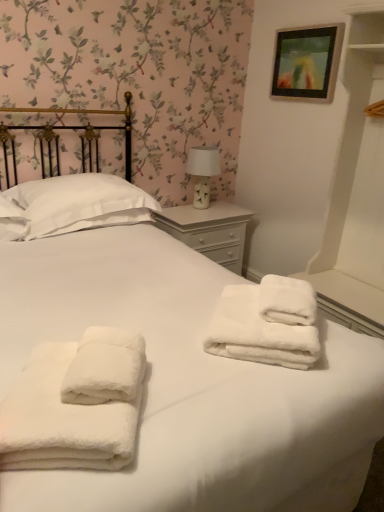
This screenshot has width=384, height=512. Find the location of `white fluffy towels at center, the 1th towel when ordered from front to back`. white fluffy towels at center, the 1th towel when ordered from front to back is located at coordinates (63, 420).

Measure the distance between point (223, 206) and camera.

Point (223, 206) is 3.17 meters away from camera.

Measure the distance between white fluffy towels at center, arranged as the 2th towel when viewed from the left, and camera.

1.26 meters.

Locate an element on the screen. This screenshot has height=512, width=384. white fluffy towels at center, the 1th towel when ordered from front to back is located at coordinates (63, 420).

Would you say white soft pillow at upper left is inside or outside white painted wood nightstand at center?

The correct answer is: outside.

Where is `pillow to the left of white painted wood nightstand at center`? The image size is (384, 512). pillow to the left of white painted wood nightstand at center is located at coordinates (72, 205).

Consider the image. Could you tell me if white soft pillow at upper left is facing white painted wood nightstand at center?

No.

Looking at the image, does white soft pillow at upper left seem bigger or smaller compared to white painted wood nightstand at center?

Considering their sizes, white soft pillow at upper left takes up less space than white painted wood nightstand at center.

Could wooden picture frame at upper right be considered to be inside white soft pillow at upper left?

Definitely not — wooden picture frame at upper right is not inside white soft pillow at upper left.

How different are the orientations of white soft pillow at upper left and wooden picture frame at upper right in degrees?

89.4 degrees separate the facing orientations of white soft pillow at upper left and wooden picture frame at upper right.

Which is nearer, [65,231] or [314,80]?

Point [65,231].

Which of these two, white soft pillow at upper left or wooden picture frame at upper right, is smaller?

Smaller between the two is wooden picture frame at upper right.

Between white fluffy towels at center, acting as the 2th towel starting from the back, and white fluffy towels at center, the 1th towel in the back-to-front sequence, which one is positioned in front?

white fluffy towels at center, acting as the 2th towel starting from the back, is more forward.

Considering the sizes of white fluffy towels at center, the 1th towel when ordered from front to back, and white fluffy towels at center, the 1th towel in the back-to-front sequence, in the image, is white fluffy towels at center, the 1th towel when ordered from front to back, taller or shorter than white fluffy towels at center, the 1th towel in the back-to-front sequence,?

white fluffy towels at center, the 1th towel when ordered from front to back, is shorter than white fluffy towels at center, the 1th towel in the back-to-front sequence.

From the image's perspective, relative to white fluffy towels at center, marked as the 2th towel in a front-to-back arrangement, is white fluffy towels at center, the 1th towel when ordered from front to back, above or below?

Clearly, from the image's perspective, white fluffy towels at center, the 1th towel when ordered from front to back, is below white fluffy towels at center, marked as the 2th towel in a front-to-back arrangement.

Could you tell me if white fluffy towels at center, acting as the 2th towel starting from the right, is turned towards white fluffy towels at center, arranged as the 2th towel when viewed from the left?

No, white fluffy towels at center, acting as the 2th towel starting from the right, is not oriented towards white fluffy towels at center, arranged as the 2th towel when viewed from the left.

Does point (160, 224) come closer to viewer compared to point (24, 234)?

No, it is not.

Considering the relative sizes of white painted wood nightstand at center and white soft pillow at upper left in the image provided, is white painted wood nightstand at center wider than white soft pillow at upper left?

Incorrect, the width of white painted wood nightstand at center does not surpass that of white soft pillow at upper left.

Considering the sizes of objects white painted wood nightstand at center and white soft pillow at upper left in the image provided, who is bigger, white painted wood nightstand at center or white soft pillow at upper left?

white painted wood nightstand at center is bigger.

From the image's perspective, which is above, white painted wood nightstand at center or white soft pillow at upper left?

white soft pillow at upper left is shown above in the image.

Based on the photo, would you say white painted wood nightstand at center is outside white fluffy towels at center, which appears as the first towel when viewed from the left?

white painted wood nightstand at center is positioned outside white fluffy towels at center, which appears as the first towel when viewed from the left.

Is point (197, 243) closer or farther from the camera than point (7, 450)?

Point (197, 243) is farther from the camera than point (7, 450).

From a real-world perspective, does white painted wood nightstand at center sit lower than white fluffy towels at center, the 1th towel when ordered from front to back?

Yes, from a real-world perspective, white painted wood nightstand at center is beneath white fluffy towels at center, the 1th towel when ordered from front to back.

Can you confirm if white painted wood nightstand at center is taller than white fluffy towels at center, acting as the 2th towel starting from the back?

Yes, white painted wood nightstand at center is taller than white fluffy towels at center, acting as the 2th towel starting from the back.

Visually, is white fluffy towels at center, arranged as the 2th towel when viewed from the left, positioned to the left or to the right of wooden picture frame at upper right?

Clearly, white fluffy towels at center, arranged as the 2th towel when viewed from the left, is on the left of wooden picture frame at upper right in the image.

Looking at this image, is white fluffy towels at center, acting as the first towel starting from the right, taller than wooden picture frame at upper right?

No, white fluffy towels at center, acting as the first towel starting from the right, is not taller than wooden picture frame at upper right.

Which is in front, point (259, 322) or point (284, 50)?

The point (259, 322) is closer to the camera.

Looking at this image, from the image's perspective, is white fluffy towels at center, the 1th towel in the back-to-front sequence, under wooden picture frame at upper right?

Yes, from the image's perspective, white fluffy towels at center, the 1th towel in the back-to-front sequence, is beneath wooden picture frame at upper right.

Would you consider white ceramic table lamp at upper right to be distant from white painted wood nightstand at center?

They are positioned close to each other.

Which object is positioned more to the right, white ceramic table lamp at upper right or white painted wood nightstand at center?

From the viewer's perspective, white painted wood nightstand at center appears more on the right side.

Is white painted wood nightstand at center inside white ceramic table lamp at upper right?

No.

Where is `nightstand below the white ceramic table lamp at upper right (from a real-world perspective)`? nightstand below the white ceramic table lamp at upper right (from a real-world perspective) is located at coordinates (209, 230).

Where is `pillow above the white painted wood nightstand at center (from a real-world perspective)`? The image size is (384, 512). pillow above the white painted wood nightstand at center (from a real-world perspective) is located at coordinates (72, 205).

The image size is (384, 512). I want to click on picture frame lying on the right of white soft pillow at upper left, so click(307, 62).

Based on their spatial positions, is white soft pillow at upper left or white fluffy towels at center, marked as the 2th towel in a front-to-back arrangement, closer to white painted wood nightstand at center?

Among the two, white soft pillow at upper left is located nearer to white painted wood nightstand at center.

Which object lies further to the anchor point white ceramic table lamp at upper right, white fluffy towels at center, which appears as the first towel when viewed from the left, or white soft pillow at upper left?

white fluffy towels at center, which appears as the first towel when viewed from the left, is further to white ceramic table lamp at upper right.

Based on their spatial positions, is white ceramic table lamp at upper right or white painted wood nightstand at center closer to white soft pillow at upper left?

white painted wood nightstand at center is positioned closer to the anchor white soft pillow at upper left.

From the image, which object appears to be farther from white soft pillow at upper left, white painted wood nightstand at center or white ceramic table lamp at upper right?

white ceramic table lamp at upper right lies further to white soft pillow at upper left than the other object.

Looking at the image, which one is located closer to white fluffy towels at center, marked as the 2th towel in a front-to-back arrangement, white soft pillow at upper left or white ceramic table lamp at upper right?

white soft pillow at upper left lies closer to white fluffy towels at center, marked as the 2th towel in a front-to-back arrangement, than the other object.

When comparing their distances from white painted wood nightstand at center, does wooden picture frame at upper right or white fluffy towels at center, acting as the 2th towel starting from the right, seem closer?

wooden picture frame at upper right is positioned closer to the anchor white painted wood nightstand at center.

Considering their positions, is white ceramic table lamp at upper right positioned further to white painted wood nightstand at center than white soft pillow at upper left?

The object further to white painted wood nightstand at center is white soft pillow at upper left.

Based on their spatial positions, is white soft pillow at upper left or white fluffy towels at center, the 1th towel in the back-to-front sequence, closer to wooden picture frame at upper right?

white soft pillow at upper left lies closer to wooden picture frame at upper right than the other object.

Find the location of a particular element. picture frame between white fluffy towels at center, the 1th towel in the back-to-front sequence, and white painted wood nightstand at center from front to back is located at coordinates (307, 62).

Locate an element on the screen. The height and width of the screenshot is (512, 384). picture frame positioned between white fluffy towels at center, acting as the 2th towel starting from the back, and white ceramic table lamp at upper right from near to far is located at coordinates (307, 62).

The image size is (384, 512). I want to click on nightstand located between white soft pillow at upper left and wooden picture frame at upper right in the left-right direction, so click(x=209, y=230).

The height and width of the screenshot is (512, 384). Find the location of `towel between wooden picture frame at upper right and white fluffy towels at center, acting as the 2th towel starting from the right, vertically`. towel between wooden picture frame at upper right and white fluffy towels at center, acting as the 2th towel starting from the right, vertically is located at coordinates (258, 332).